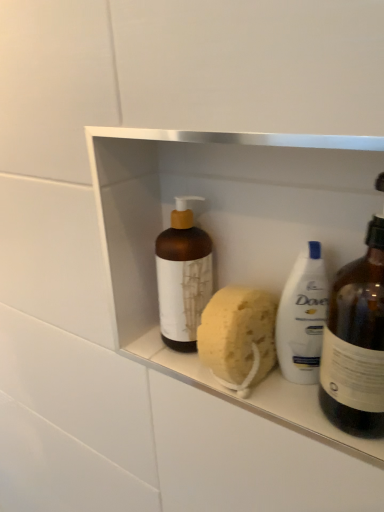
Question: Is brown matte bottle at center, the 1th bottle from the left, behind matte brown bottle at right, which ranks as the second bottle in left-to-right order?

Choices:
 (A) yes
 (B) no

Answer: (A)

Question: Does brown matte bottle at center, the 1th bottle from the left, have a lesser height compared to matte brown bottle at right, which ranks as the second bottle in left-to-right order?

Choices:
 (A) yes
 (B) no

Answer: (A)

Question: Can you confirm if brown matte bottle at center, the 1th bottle from the left, is positioned to the left of matte brown bottle at right, marked as the first bottle in a right-to-left arrangement?

Choices:
 (A) no
 (B) yes

Answer: (B)

Question: Could you tell me if brown matte bottle at center, the 1th bottle from the left, is facing matte brown bottle at right, marked as the first bottle in a right-to-left arrangement?

Choices:
 (A) yes
 (B) no

Answer: (B)

Question: Is brown matte bottle at center, which is the second bottle from right to left, bigger than matte brown bottle at right, marked as the first bottle in a right-to-left arrangement?

Choices:
 (A) yes
 (B) no

Answer: (B)

Question: Would you say brown matte bottle at center, which is the second bottle from right to left, contains matte brown bottle at right, which ranks as the second bottle in left-to-right order?

Choices:
 (A) yes
 (B) no

Answer: (B)

Question: Is matte brown bottle at right, marked as the first bottle in a right-to-left arrangement, oriented towards yellow sponge at center?

Choices:
 (A) yes
 (B) no

Answer: (B)

Question: Does matte brown bottle at right, marked as the first bottle in a right-to-left arrangement, have a greater width compared to yellow sponge at center?

Choices:
 (A) no
 (B) yes

Answer: (B)

Question: Is matte brown bottle at right, marked as the first bottle in a right-to-left arrangement, smaller than yellow sponge at center?

Choices:
 (A) yes
 (B) no

Answer: (B)

Question: Is matte brown bottle at right, which ranks as the second bottle in left-to-right order, at the right side of yellow sponge at center?

Choices:
 (A) yes
 (B) no

Answer: (A)

Question: Is matte brown bottle at right, which ranks as the second bottle in left-to-right order, far away from yellow sponge at center?

Choices:
 (A) yes
 (B) no

Answer: (B)

Question: Is matte brown bottle at right, which ranks as the second bottle in left-to-right order, turned away from yellow sponge at center?

Choices:
 (A) yes
 (B) no

Answer: (B)

Question: Does yellow sponge at center appear on the right side of brown matte bottle at center, the 1th bottle from the left?

Choices:
 (A) no
 (B) yes

Answer: (B)